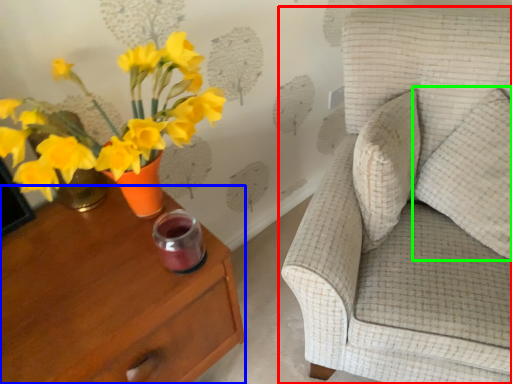
Question: Which is nearer to the chair (highlighted by a red box)? nightstand (highlighted by a blue box) or pillow (highlighted by a green box).

Choices:
 (A) nightstand
 (B) pillow

Answer: (B)